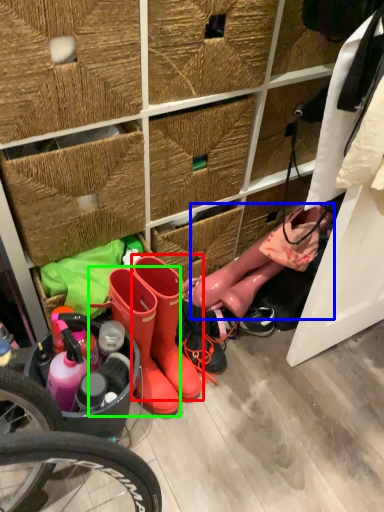
Question: Considering the real-world distances, which object is farthest from footwear (highlighted by a red box)? footwear (highlighted by a blue box) or footwear (highlighted by a green box)?

Choices:
 (A) footwear
 (B) footwear

Answer: (A)